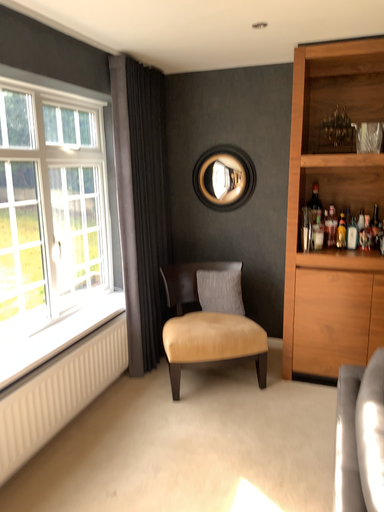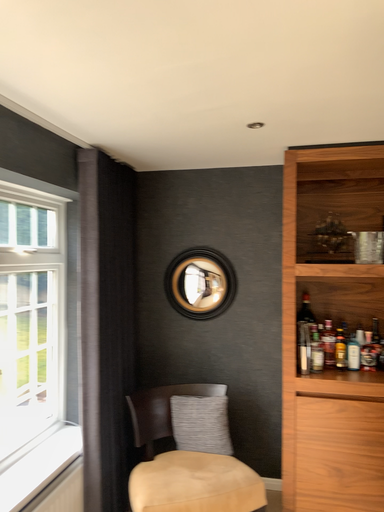
Question: Which way did the camera rotate in the video?

Choices:
 (A) rotated downward
 (B) rotated upward

Answer: (B)